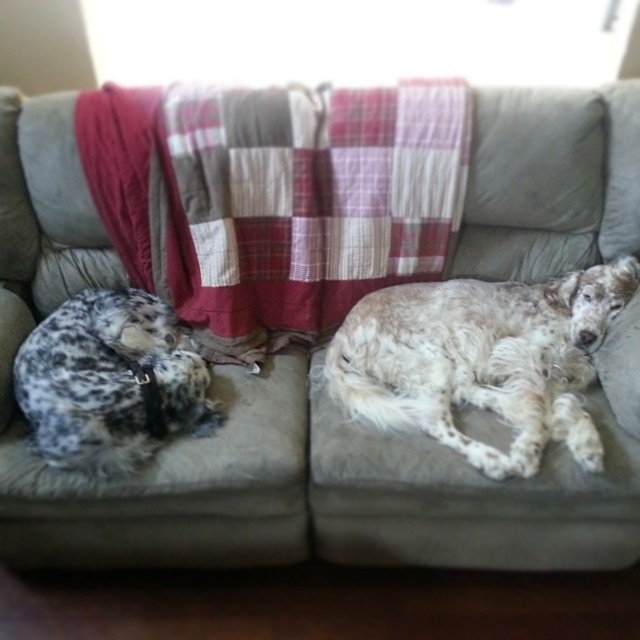
Question: Which point is farther to the camera?

Choices:
 (A) spotted fur at left
 (B) speckled fur dog at right
 (C) plaid fabric blanket at center

Answer: (C)

Question: Considering the real-world distances, which object is closest to the speckled fur dog at right?

Choices:
 (A) spotted fur at left
 (B) plaid fabric blanket at center

Answer: (B)

Question: Can you confirm if plaid fabric blanket at center is bigger than spotted fur at left?

Choices:
 (A) no
 (B) yes

Answer: (B)

Question: Among these objects, which one is farthest from the camera?

Choices:
 (A) speckled fur dog at right
 (B) spotted fur at left

Answer: (A)

Question: Where is plaid fabric blanket at center located in relation to spotted fur at left in the image?

Choices:
 (A) above
 (B) below

Answer: (A)

Question: Does plaid fabric blanket at center appear on the right side of speckled fur dog at right?

Choices:
 (A) yes
 (B) no

Answer: (B)